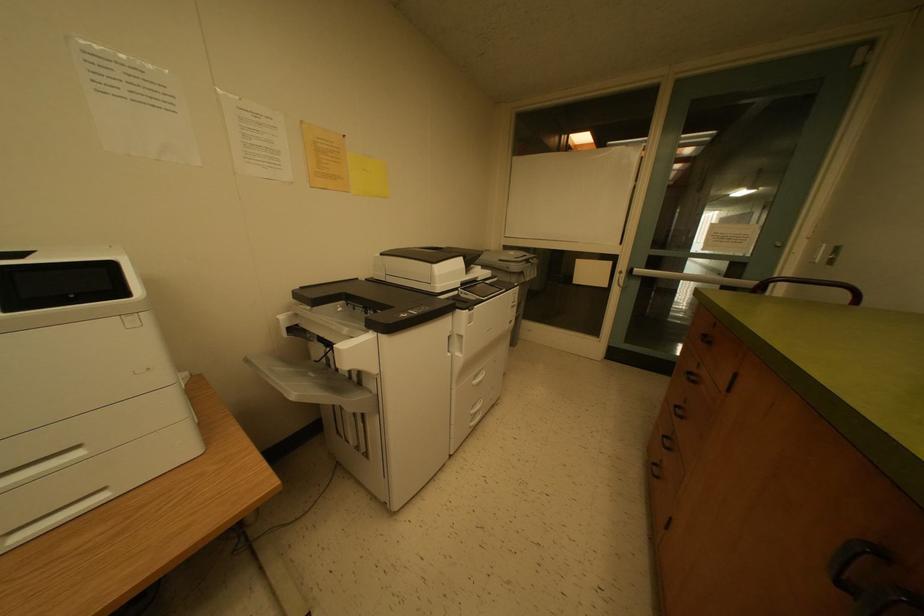
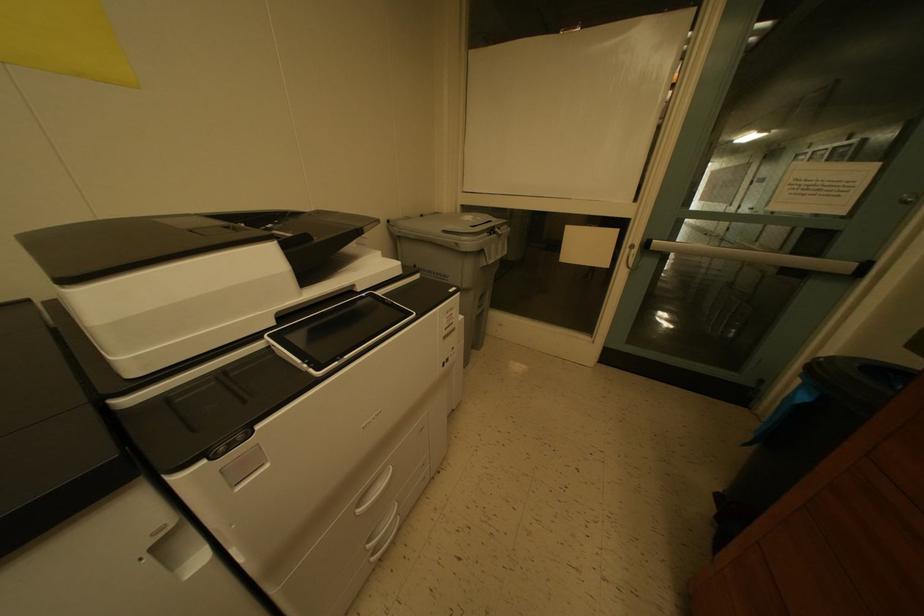
Which direction would the cameraman need to move to produce the second image?

The movement direction of the cameraman is right, forward.